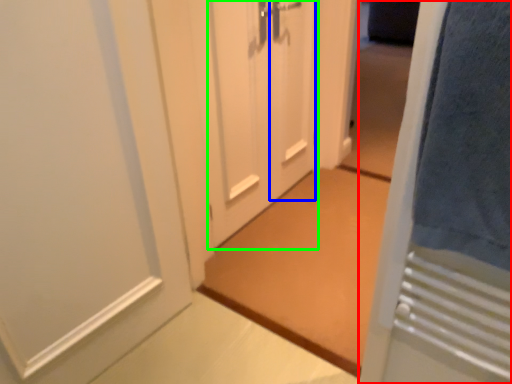
Question: Estimate the real-world distances between objects in this image. Which object is closer to door (highlighted by a red box), door (highlighted by a blue box) or door (highlighted by a green box)?

Choices:
 (A) door
 (B) door

Answer: (B)